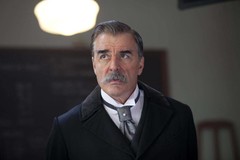
This screenshot has height=160, width=240. Identify the location of chair. (215, 126).